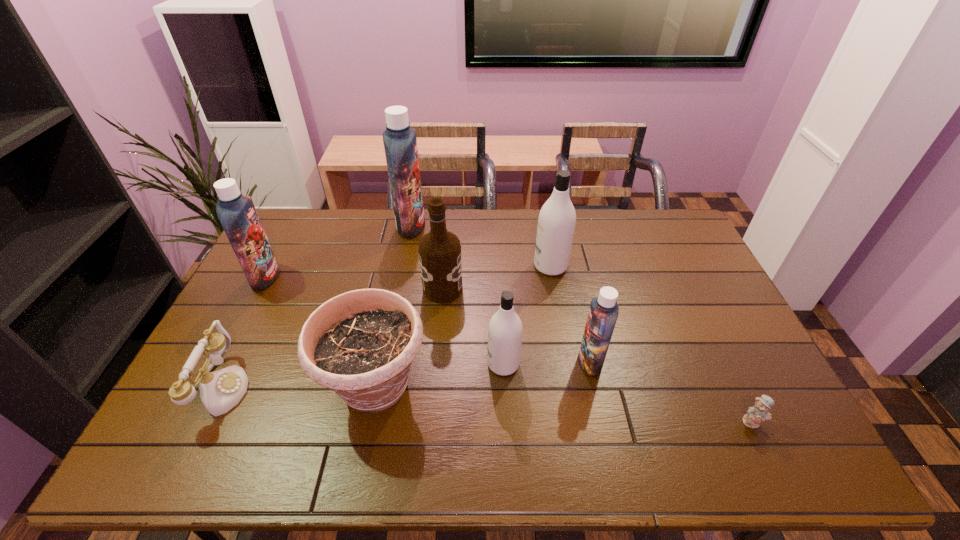
The image size is (960, 540). In the image, there is a desktop. What are the coordinates of `vacant space at the near left corner` in the screenshot? It's located at (175, 448).

Where is `vacant space at the far right corner of the desktop`? vacant space at the far right corner of the desktop is located at coordinates click(687, 248).

Where is `free spot between the rightmost object and the seventh tallest object`? The width and height of the screenshot is (960, 540). free spot between the rightmost object and the seventh tallest object is located at coordinates click(x=564, y=404).

Find the location of a particular element. The width and height of the screenshot is (960, 540). free space between the seventh tallest object and the rightmost object is located at coordinates (564, 404).

Locate an element on the screen. vacant space that is in between the blue teddy bear and the farthest blue shampoo is located at coordinates (582, 323).

This screenshot has height=540, width=960. I want to click on vacant space that's between the second blue shampoo from right to left and the right white shampoo, so click(481, 246).

What are the coordinates of `unoccupied position between the bigger white shampoo and the smallest blue shampoo` in the screenshot? It's located at (570, 314).

Locate an element on the screen. vacant space that's between the second biggest blue shampoo and the fourth shampoo from right to left is located at coordinates (338, 251).

The width and height of the screenshot is (960, 540). I want to click on unoccupied area between the white telephone and the third shortest object, so click(300, 387).

In order to click on object that is the fourth closest to the seventh tallest object in this screenshot , I will do `click(237, 214)`.